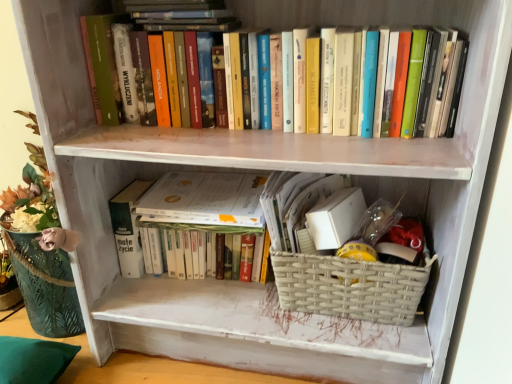
Question: Are woven beige basket at lower center and white paper at center far apart?

Choices:
 (A) yes
 (B) no

Answer: (B)

Question: Could you tell me if woven beige basket at lower center is facing white paper at center?

Choices:
 (A) no
 (B) yes

Answer: (A)

Question: From a real-world perspective, is woven beige basket at lower center located higher than white paper at center?

Choices:
 (A) yes
 (B) no

Answer: (B)

Question: Does woven beige basket at lower center have a lesser width compared to white paper at center?

Choices:
 (A) no
 (B) yes

Answer: (A)

Question: Is woven beige basket at lower center at the left side of white paper at center?

Choices:
 (A) yes
 (B) no

Answer: (B)

Question: Is woven beige basket at lower center outside of white paper at center?

Choices:
 (A) no
 (B) yes

Answer: (B)

Question: Considering the relative sizes of hardcover book at center, the second book when ordered from top to bottom, and hardcover books at upper center, which is the 2th book from bottom to top, in the image provided, is hardcover book at center, the second book when ordered from top to bottom, shorter than hardcover books at upper center, which is the 2th book from bottom to top,?

Choices:
 (A) no
 (B) yes

Answer: (B)

Question: Can you confirm if hardcover book at center, the second book when ordered from top to bottom, is taller than hardcover books at upper center, which is the 2th book from bottom to top?

Choices:
 (A) no
 (B) yes

Answer: (A)

Question: Is hardcover book at center, the 1th book in the bottom-to-top sequence, wider than hardcover books at upper center, which ranks as the first book in top-to-bottom order?

Choices:
 (A) no
 (B) yes

Answer: (A)

Question: Does hardcover book at center, the second book when ordered from top to bottom, turn towards hardcover books at upper center, which ranks as the first book in top-to-bottom order?

Choices:
 (A) yes
 (B) no

Answer: (B)

Question: Can you confirm if hardcover book at center, the 1th book in the bottom-to-top sequence, is thinner than hardcover books at upper center, which is the 2th book from bottom to top?

Choices:
 (A) yes
 (B) no

Answer: (A)

Question: Does hardcover book at center, the second book when ordered from top to bottom, contain hardcover books at upper center, which is the 2th book from bottom to top?

Choices:
 (A) no
 (B) yes

Answer: (A)

Question: Is hardcover books at upper center, which is the 2th book from bottom to top, smaller than woven beige basket at lower center?

Choices:
 (A) no
 (B) yes

Answer: (A)